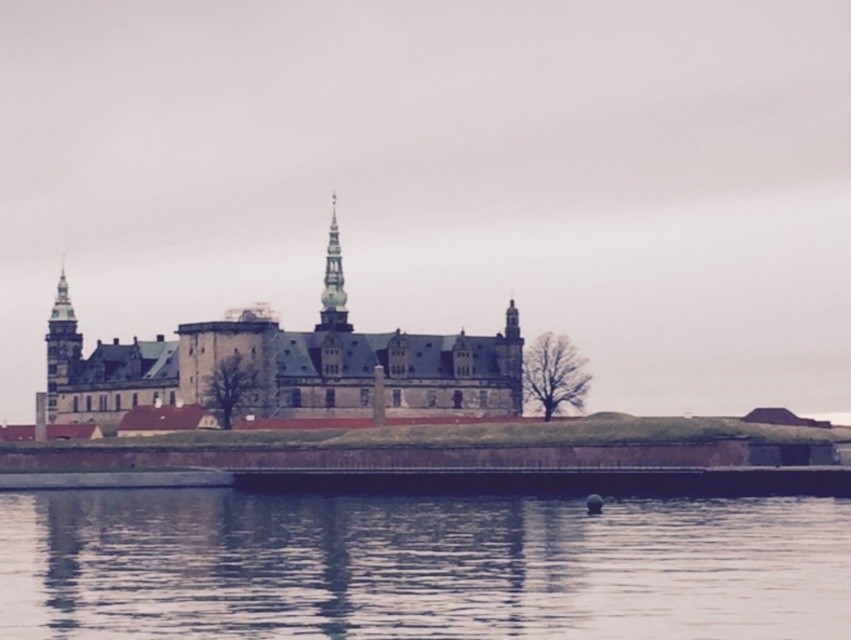
Question: Which point is closer to the camera taking this photo?

Choices:
 (A) (504, 588)
 (B) (333, 259)
 (C) (140, 376)

Answer: (A)

Question: Can you confirm if brown stone castle at center is positioned below smooth gray stone tower at center?

Choices:
 (A) yes
 (B) no

Answer: (A)

Question: Is brown stone castle at center positioned before smooth gray stone tower at center?

Choices:
 (A) no
 (B) yes

Answer: (B)

Question: Considering the real-world distances, which object is farthest from the smooth water at lower center?

Choices:
 (A) brown stone castle at center
 (B) smooth gray stone tower at center

Answer: (B)

Question: In this image, where is smooth water at lower center located relative to smooth gray stone tower at center?

Choices:
 (A) right
 (B) left

Answer: (A)

Question: Which of the following is the closest to the observer?

Choices:
 (A) brown stone castle at center
 (B) smooth water at lower center

Answer: (B)